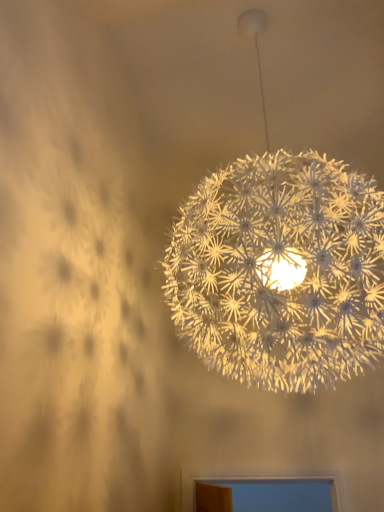
What are the coordinates of `white textured sphere at center` in the screenshot? It's located at click(x=280, y=266).

What do you see at coordinates (280, 266) in the screenshot? The width and height of the screenshot is (384, 512). I see `white textured sphere at center` at bounding box center [280, 266].

Identify the location of white textured sphere at center. (280, 266).